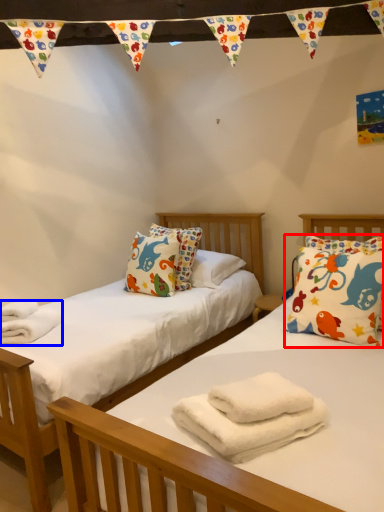
Question: Which of the following is the farthest to the observer, pillow (highlighted by a red box) or material (highlighted by a blue box)?

Choices:
 (A) pillow
 (B) material

Answer: (B)